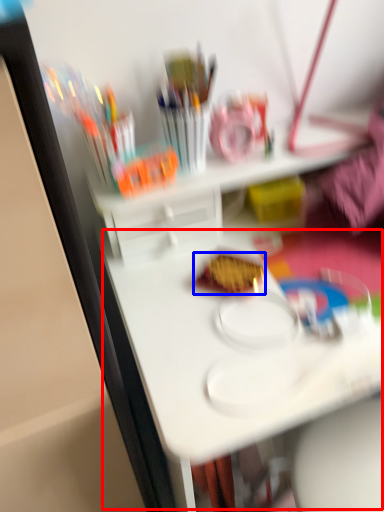
Question: Which object is closer to the camera taking this photo, table (highlighted by a red box) or food (highlighted by a blue box)?

Choices:
 (A) table
 (B) food

Answer: (A)